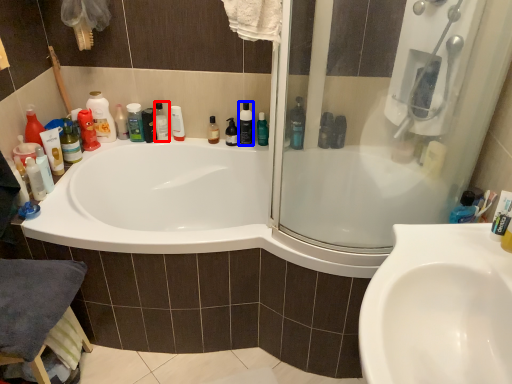
Question: Which point is closer to the camera, cleaning product (highlighted by a red box) or mouthwash (highlighted by a blue box)?

Choices:
 (A) cleaning product
 (B) mouthwash

Answer: (B)